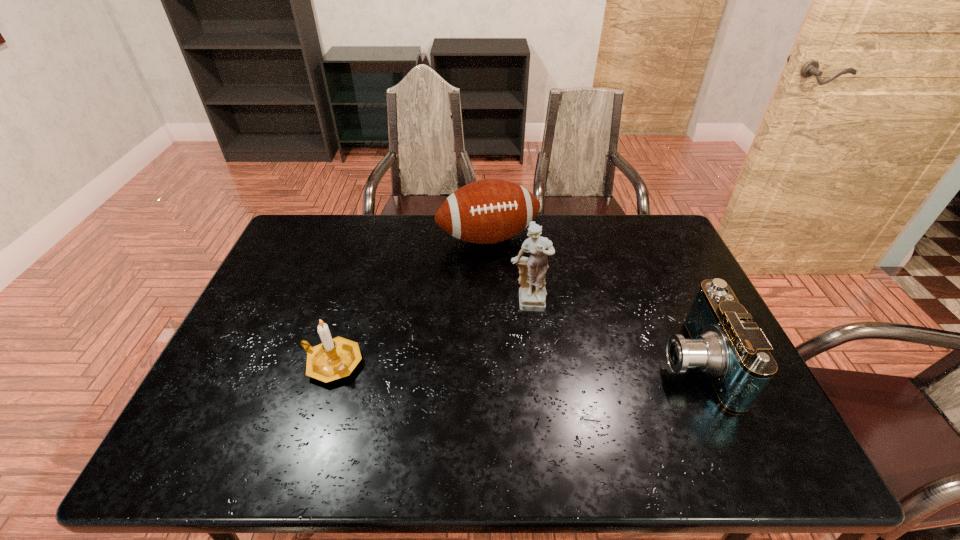
This screenshot has width=960, height=540. I want to click on the leftmost object, so click(x=336, y=358).

You are a GUI agent. You are given a task and a screenshot of the screen. Output one action in this format:
    pyautogui.click(x=<x>, y=<y>)
    Task: Click on the camcorder
    This screenshot has width=960, height=540.
    Given the screenshot: What is the action you would take?
    pyautogui.click(x=724, y=343)

This screenshot has width=960, height=540. What are the coordinates of `the farthest object` in the screenshot? It's located at (488, 211).

Identify the location of the second tallest object. (488, 211).

This screenshot has height=540, width=960. In order to click on figurine in this screenshot , I will do `click(532, 293)`.

This screenshot has height=540, width=960. In order to click on vacant area situated with a handle on the candle holder in this screenshot , I will do `click(253, 363)`.

At what (x,y) coordinates should I click in order to perform the action: click on free space located 0.180m with a handle on the candle holder. Please return your answer as a coordinate pair (x, y). Looking at the image, I should click on (229, 363).

This screenshot has height=540, width=960. In order to click on free space located with a handle on the candle holder in this screenshot , I will do `click(273, 363)`.

You are a GUI agent. You are given a task and a screenshot of the screen. Output one action in this format:
    pyautogui.click(x=<x>, y=<y>)
    Task: Click on the free space located 0.180m on the front-facing side of the rightmost object
    Image resolution: width=960 pixels, height=540 pixels.
    Given the screenshot: What is the action you would take?
    pyautogui.click(x=588, y=363)

Locate an element on the screen. This screenshot has width=960, height=540. vacant point located 0.240m on the front-facing side of the rightmost object is located at coordinates (564, 363).